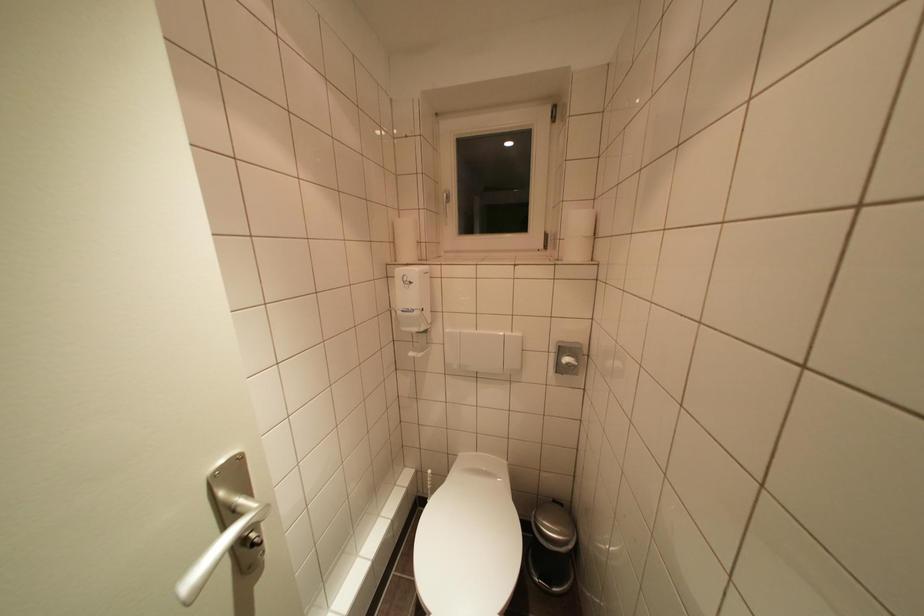
Identify the location of toilet brush handle. (428, 483).